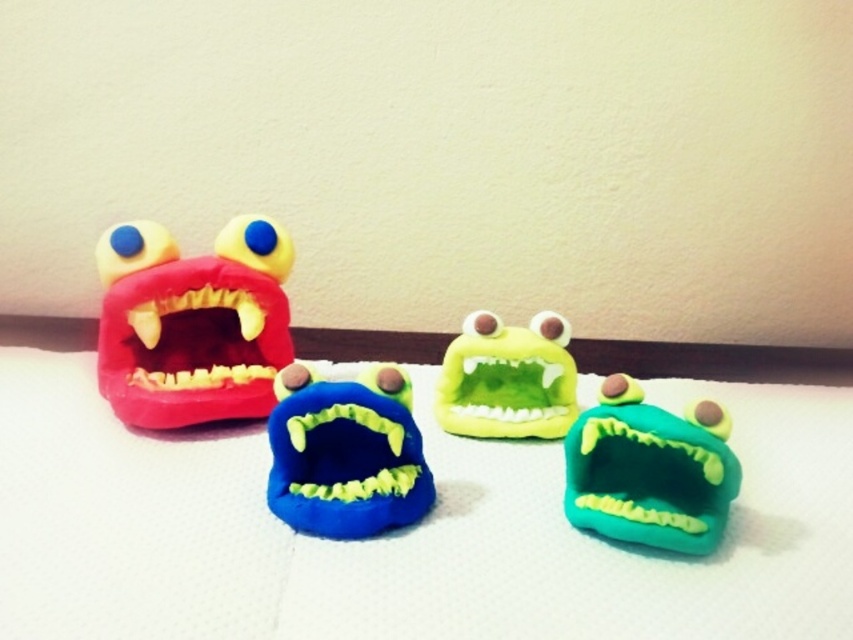
Question: Can you confirm if matte plastic monster at left is positioned to the left of green matte toy at center?

Choices:
 (A) yes
 (B) no

Answer: (A)

Question: Which object is positioned closest to the matte plastic mouth at left?

Choices:
 (A) matte plastic monster at left
 (B) green matte plush toy at center
 (C) blue fuzzy monster at center

Answer: (A)

Question: Which point is farther from the camera taking this photo?

Choices:
 (A) [x=306, y=388]
 (B) [x=523, y=396]
 (C) [x=187, y=304]
 (D) [x=631, y=531]

Answer: (B)

Question: Which point is closer to the camera?

Choices:
 (A) blue fuzzy monster at center
 (B) matte plastic monster at left
 (C) green matte toy at center

Answer: (C)

Question: Is green matte toy at center to the left of matte plastic mouth at left from the viewer's perspective?

Choices:
 (A) no
 (B) yes

Answer: (A)

Question: Can you confirm if green matte toy at center is thinner than green matte plush toy at center?

Choices:
 (A) no
 (B) yes

Answer: (B)